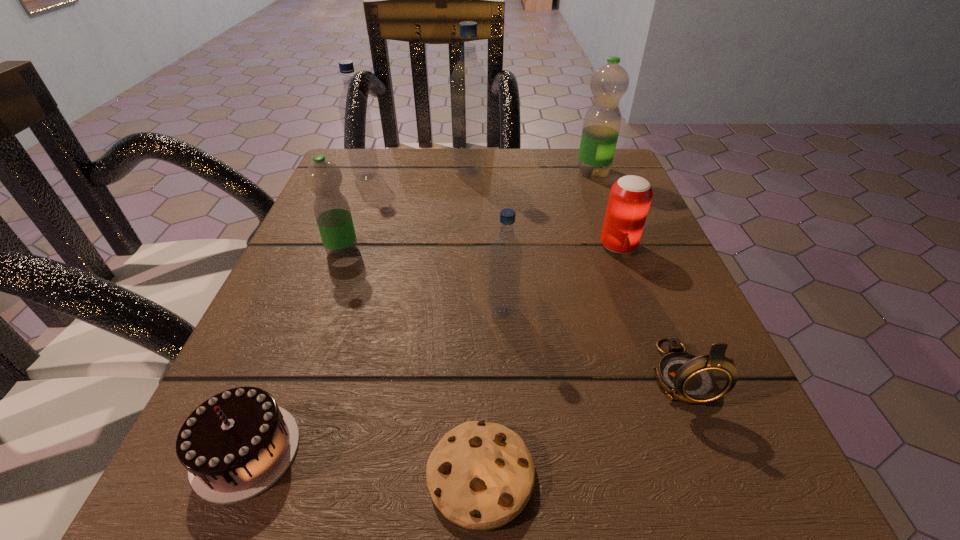
At what (x,y) coordinates should I click in order to perform the action: click on free space located on the face of the compass. Please return your answer as a coordinate pair (x, y). Looking at the image, I should click on (722, 478).

You are a GUI agent. You are given a task and a screenshot of the screen. Output one action in this format:
    pyautogui.click(x=<x>, y=<y>)
    Task: Click on the free space located 0.210m on the right of the chocolate cake
    
    Given the screenshot: What is the action you would take?
    pyautogui.click(x=479, y=451)

You are a GUI agent. You are given a task and a screenshot of the screen. Output one action in this format:
    pyautogui.click(x=<x>, y=<y>)
    Task: Click on the free location located 0.230m on the left of the cookie
    This screenshot has width=960, height=540.
    Given the screenshot: What is the action you would take?
    pyautogui.click(x=219, y=475)

Where is `chocolate cake located in the near edge section of the desktop`? Image resolution: width=960 pixels, height=540 pixels. chocolate cake located in the near edge section of the desktop is located at coordinates (238, 443).

Locate an element on the screen. The image size is (960, 540). cookie at the near edge is located at coordinates (481, 475).

Image resolution: width=960 pixels, height=540 pixels. I want to click on chocolate cake located in the left edge section of the desktop, so click(238, 443).

The width and height of the screenshot is (960, 540). I want to click on water bottle at the right edge, so click(x=608, y=84).

At what (x,y) coordinates should I click in order to perform the action: click on beer can positioned at the right edge. Please return your answer as a coordinate pair (x, y). Image resolution: width=960 pixels, height=540 pixels. Looking at the image, I should click on (630, 197).

You are a GUI agent. You are given a task and a screenshot of the screen. Output one action in this format:
    pyautogui.click(x=<x>, y=<y>)
    Task: Click on the compass located in the right edge section of the desktop
    This screenshot has width=960, height=540.
    Given the screenshot: What is the action you would take?
    pyautogui.click(x=684, y=377)

What are the coordinates of `object present at the far left corner` in the screenshot? It's located at (353, 106).